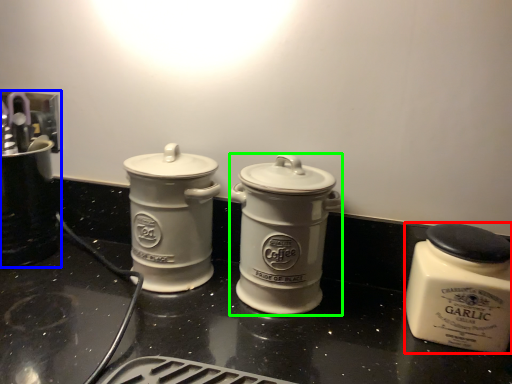
Question: Which object is the farthest from kitchen appliance (highlighted by a red box)? Choose among these: appliance (highlighted by a blue box) or kitchen appliance (highlighted by a green box).

Choices:
 (A) appliance
 (B) kitchen appliance

Answer: (A)